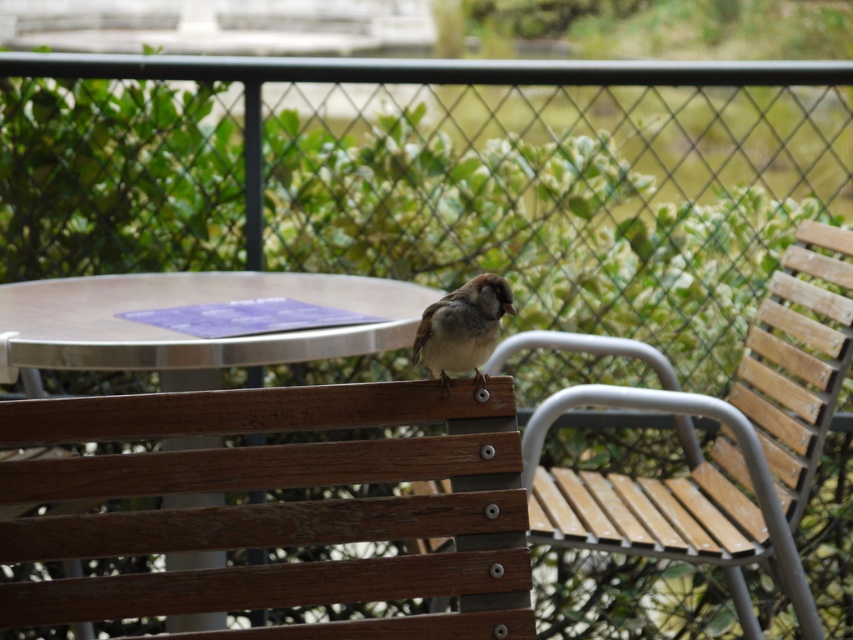
Question: Can you confirm if wooden slats at center is positioned above brown feathered sparrow at center?

Choices:
 (A) no
 (B) yes

Answer: (A)

Question: Does wooden slats bench at center appear over brown feathered sparrow at center?

Choices:
 (A) yes
 (B) no

Answer: (B)

Question: Is wooden slats bench at center to the right of wooden slats at center from the viewer's perspective?

Choices:
 (A) yes
 (B) no

Answer: (B)

Question: Based on their relative distances, which object is nearer to the wooden slats at center?

Choices:
 (A) wooden slats bench at center
 (B) brown feathered sparrow at center
 (C) metallic silver table at center

Answer: (C)

Question: Estimate the real-world distances between objects in this image. Which object is farther from the brown feathered sparrow at center?

Choices:
 (A) wooden slats bench at center
 (B) metallic silver table at center
 (C) wooden slats at center

Answer: (C)

Question: Which point is closer to the camera?

Choices:
 (A) (418, 588)
 (B) (16, 289)

Answer: (A)